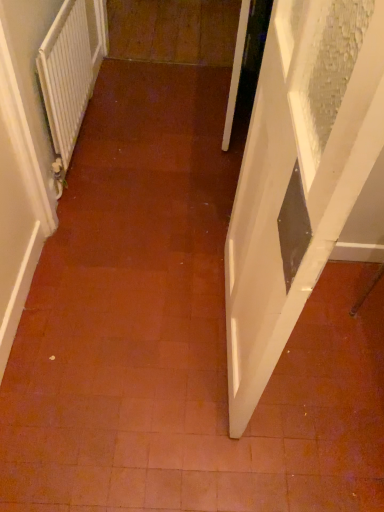
Question: Is white glossy door at right wider or thinner than white textured radiator at left?

Choices:
 (A) wide
 (B) thin

Answer: (A)

Question: From a real-world perspective, relative to white textured radiator at left, is white glossy door at right vertically above or below?

Choices:
 (A) below
 (B) above

Answer: (B)

Question: Looking at the image, does white glossy door at right seem bigger or smaller compared to white textured radiator at left?

Choices:
 (A) big
 (B) small

Answer: (A)

Question: Is white textured radiator at left in front of or behind white glossy door at right in the image?

Choices:
 (A) behind
 (B) front

Answer: (A)

Question: From the image's perspective, is white textured radiator at left located above or below white glossy door at right?

Choices:
 (A) below
 (B) above

Answer: (B)

Question: Is point (99, 64) closer or farther from the camera than point (331, 105)?

Choices:
 (A) farther
 (B) closer

Answer: (A)

Question: Based on their positions, is white textured radiator at left located to the left or right of white glossy door at right?

Choices:
 (A) right
 (B) left

Answer: (B)